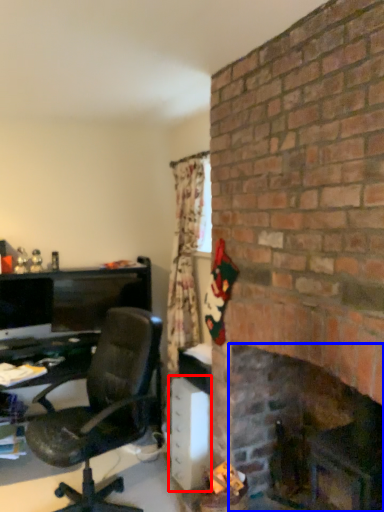
Question: Which point is further to the camera, file cabinet (highlighted by a red box) or fireplace (highlighted by a blue box)?

Choices:
 (A) file cabinet
 (B) fireplace

Answer: (A)